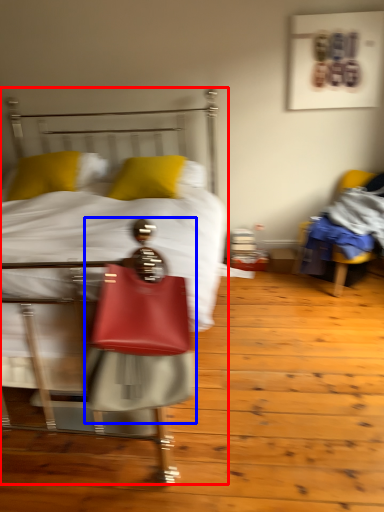
Question: Which object appears farthest to the camera in this image, bed (highlighted by a red box) or person (highlighted by a blue box)?

Choices:
 (A) bed
 (B) person

Answer: (B)